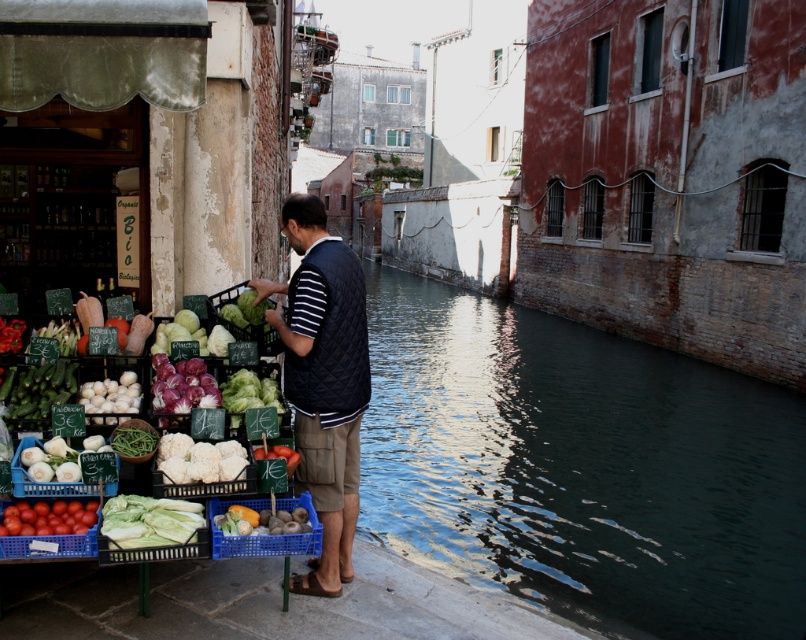
You are a tourist standing at the edge of the canal in the historic market area. You see a vegetable stall with various produce. There is a point marked at coordinates (x=219, y=486). What vegetable is located at that point?

The vegetable located at point (x=219, y=486) is the matte green cabbage at left.

You are a chef preparing a recipe that requires both the purple glossy onion at left and the smooth brown kiwi at center. You need to grab both items quickly. How far apart are they?

The distance between the purple glossy onion at left and the smooth brown kiwi at center is 33.00 inches.

You are a customer at the vegetable stall and want to buy the largest vegetable available. Which one should you choose between the matte green cabbage at left and the ripe red tomato at lower left?

The matte green cabbage at left is bigger than the ripe red tomato at lower left, so you should choose the matte green cabbage at left.